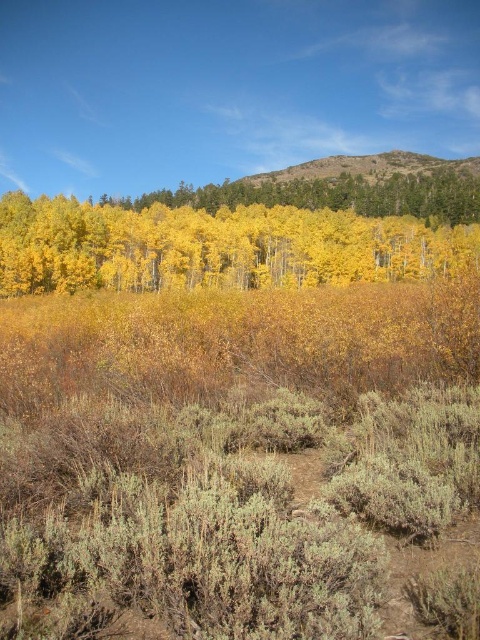
The width and height of the screenshot is (480, 640). I want to click on yellow matte trees at center, so click(215, 246).

Which is behind, point (372, 266) or point (193, 193)?

Point (193, 193)

This screenshot has height=640, width=480. Describe the element at coordinates (215, 246) in the screenshot. I see `yellow matte trees at center` at that location.

Locate an element on the screen. Image resolution: width=480 pixels, height=640 pixels. yellow matte trees at center is located at coordinates (215, 246).